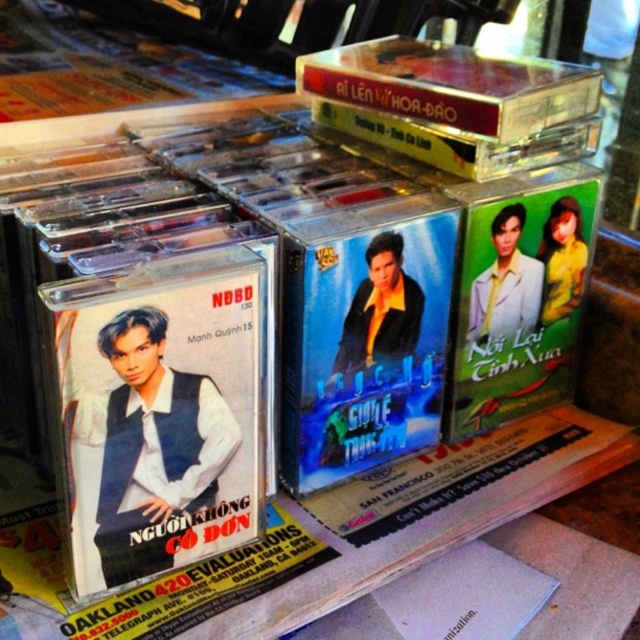
Question: From the image, what is the correct spatial relationship of matte black cassette at center in relation to green matte poster at center-right?

Choices:
 (A) above
 (B) below

Answer: (B)

Question: Is matte black cassette at center bigger than green matte poster at center-right?

Choices:
 (A) no
 (B) yes

Answer: (A)

Question: Does matte black cassette at center have a larger size compared to green matte poster at center-right?

Choices:
 (A) no
 (B) yes

Answer: (A)